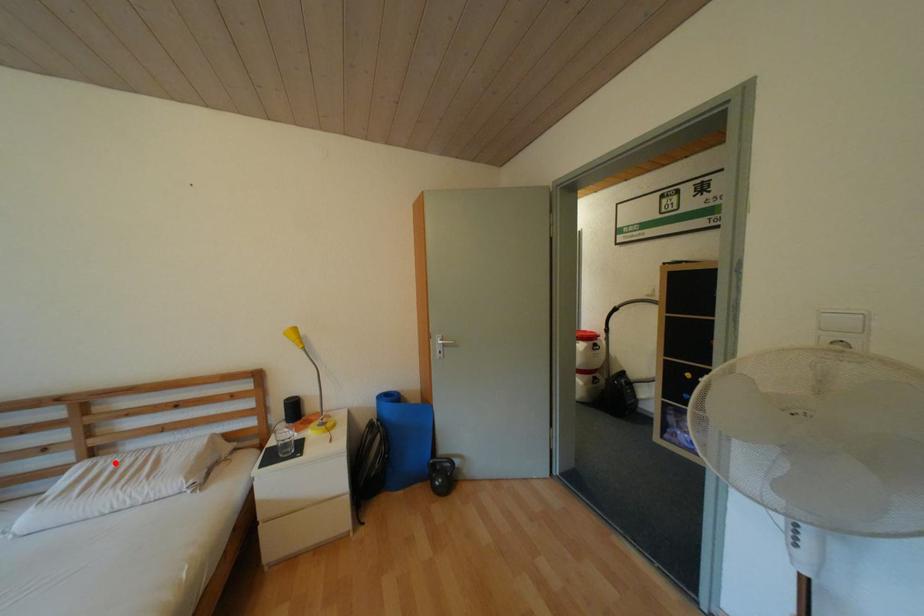
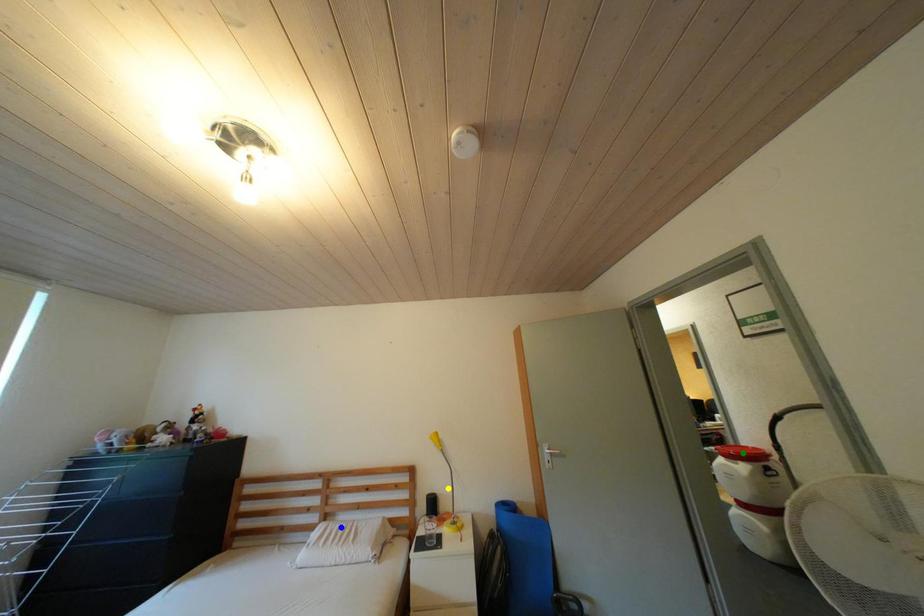
Question: I am providing you with two images of the same scene from different viewpoints. A red point is marked on the first image. You are given multiple points on the second image. In image 2, which mark is for the same physical point as the one in image 1?

Choices:
 (A) blue point
 (B) yellow point
 (C) green point

Answer: (A)